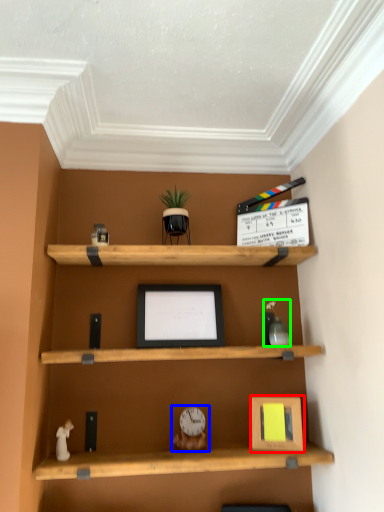
Question: Estimate the real-world distances between objects in this image. Which object is farther from picture frame (highlighted by a red box), toy (highlighted by a blue box) or toy (highlighted by a green box)?

Choices:
 (A) toy
 (B) toy

Answer: (B)